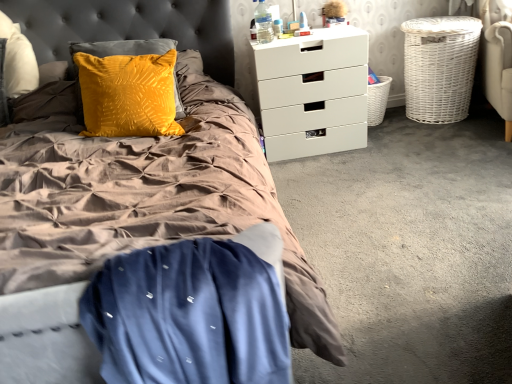
Question: Is white wicker basket at right, which appears as the second basket when viewed from the left, facing away from blue satin blanket at lower left?

Choices:
 (A) no
 (B) yes

Answer: (A)

Question: Is white wicker basket at right, which appears as the second basket when viewed from the left, thinner than blue satin blanket at lower left?

Choices:
 (A) no
 (B) yes

Answer: (A)

Question: Can you confirm if white wicker basket at right, positioned as the first basket in right-to-left order, is wider than blue satin blanket at lower left?

Choices:
 (A) no
 (B) yes

Answer: (B)

Question: Is white wicker basket at right, which appears as the second basket when viewed from the left, bigger than blue satin blanket at lower left?

Choices:
 (A) yes
 (B) no

Answer: (A)

Question: Is white wicker basket at right, positioned as the first basket in right-to-left order, surrounding blue satin blanket at lower left?

Choices:
 (A) yes
 (B) no

Answer: (B)

Question: From their relative heights in the image, would you say blue satin blanket at lower left is taller or shorter than clear plastic water bottle at upper right?

Choices:
 (A) short
 (B) tall

Answer: (B)

Question: Is blue satin blanket at lower left inside or outside of clear plastic water bottle at upper right?

Choices:
 (A) outside
 (B) inside

Answer: (A)

Question: From the image's perspective, is blue satin blanket at lower left located above or below clear plastic water bottle at upper right?

Choices:
 (A) above
 (B) below

Answer: (B)

Question: In the image, is blue satin blanket at lower left on the left side or the right side of clear plastic water bottle at upper right?

Choices:
 (A) left
 (B) right

Answer: (A)

Question: From a real-world perspective, is white wicker basket at right, which appears as the second basket when viewed from the left, physically located above or below blue satin blanket at lower left?

Choices:
 (A) above
 (B) below

Answer: (B)

Question: Looking at their shapes, would you say white wicker basket at right, positioned as the first basket in right-to-left order, is wider or thinner than blue satin blanket at lower left?

Choices:
 (A) wide
 (B) thin

Answer: (A)

Question: Would you say white wicker basket at right, which appears as the second basket when viewed from the left, is inside or outside blue satin blanket at lower left?

Choices:
 (A) outside
 (B) inside

Answer: (A)

Question: Based on their positions, is white wicker basket at right, which appears as the second basket when viewed from the left, located to the left or right of blue satin blanket at lower left?

Choices:
 (A) left
 (B) right

Answer: (B)

Question: Based on their positions, is clear plastic water bottle at upper right located to the left or right of white wicker basket at lower right, which is the 1th basket from left to right?

Choices:
 (A) right
 (B) left

Answer: (B)

Question: From their relative heights in the image, would you say clear plastic water bottle at upper right is taller or shorter than white wicker basket at lower right, which ranks as the second basket in right-to-left order?

Choices:
 (A) short
 (B) tall

Answer: (A)